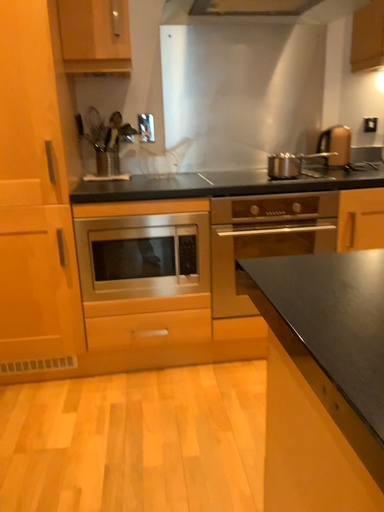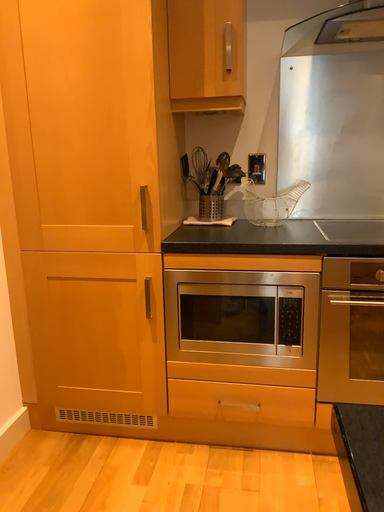
Question: How did the camera likely rotate when shooting the video?

Choices:
 (A) rotated left
 (B) rotated right

Answer: (A)